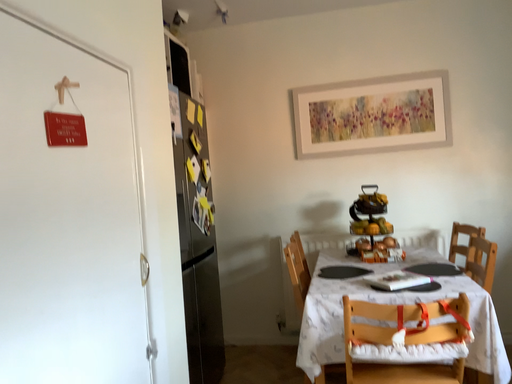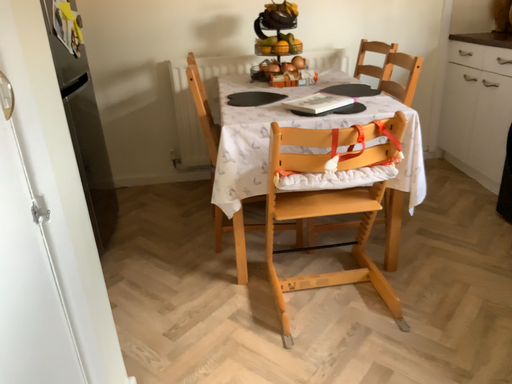
Question: How did the camera likely rotate when shooting the video?

Choices:
 (A) rotated downward
 (B) rotated upward

Answer: (A)